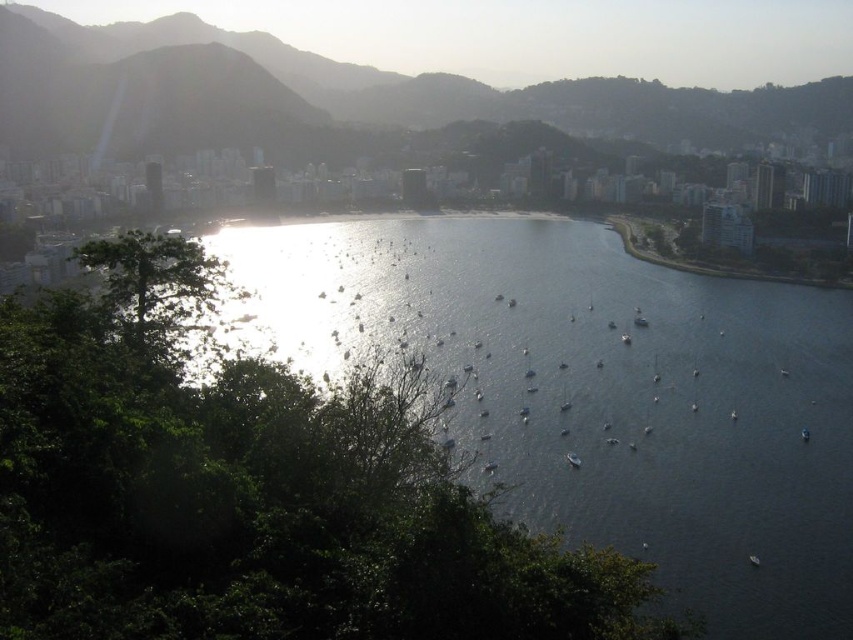
You are a photographer standing at the camera position in this coastal city scene. You want to capture a photo of the green textured mountain at upper center. Considering the distance, how far will you have to zoom your camera lens to frame the mountain properly?

The green textured mountain at upper center is 675.58 meters away from the camera. To frame it properly, you would need to adjust your camera lens to a zoom level appropriate for that distance, ensuring the mountain fills the frame without distortion.

You are a hiker standing at the base of the green leafy tree at left. You want to take a photo of the green textured mountain at upper center. Can you see the mountain clearly through the tree?

The green textured mountain at upper center is positioned over the green leafy tree at left, so yes, you can see the mountain clearly through the tree because it is above the tree.